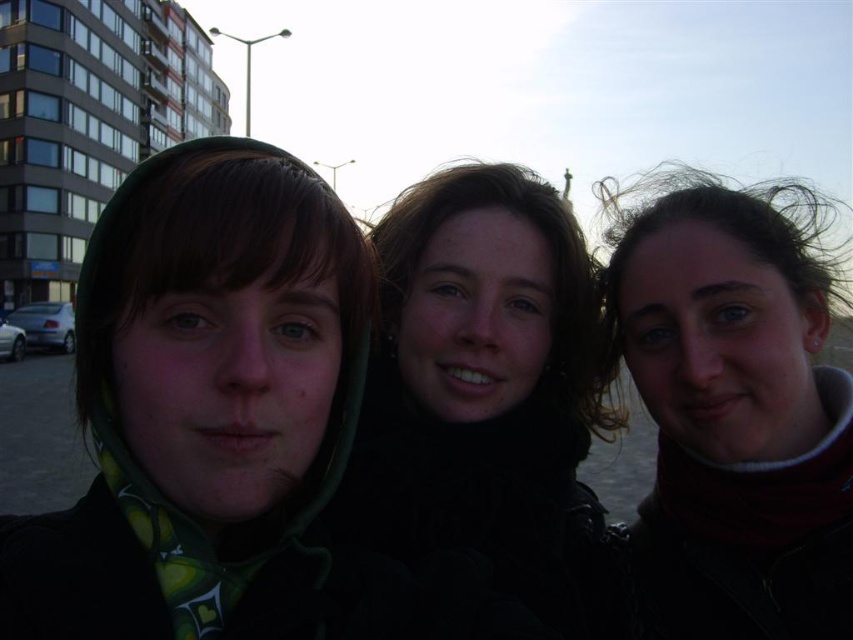
You are a photographer trying to capture a group photo of the dark brown hair at right and the black matte jacket at center. The camera you are using has a maximum focus range of 3 meters. Will you be able to focus on both subjects simultaneously?

The dark brown hair at right is 3.19 meters away from the black matte jacket at center. Since the distance between them exceeds the camera maximum focus range of 3 meters, the camera cannot focus on both subjects at the same time.

You are a photographer trying to capture a portrait of the two people in the image. You notice the green fabric headscarf at left and the dark brown hair at right. Which of these two items is positioned closer to the camera?

The green fabric headscarf at left is closer to the viewer than the dark brown hair at right, so the headscarf would appear closer to the camera in the portrait.